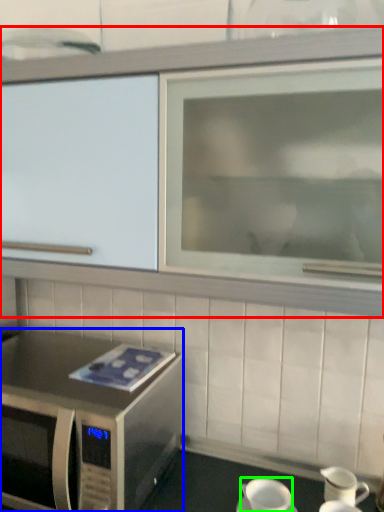
Question: Which object is positioned closest to cabinetry (highlighted by a red box)? Select from microwave oven (highlighted by a blue box) and coffee cup (highlighted by a green box).

Choices:
 (A) microwave oven
 (B) coffee cup

Answer: (A)